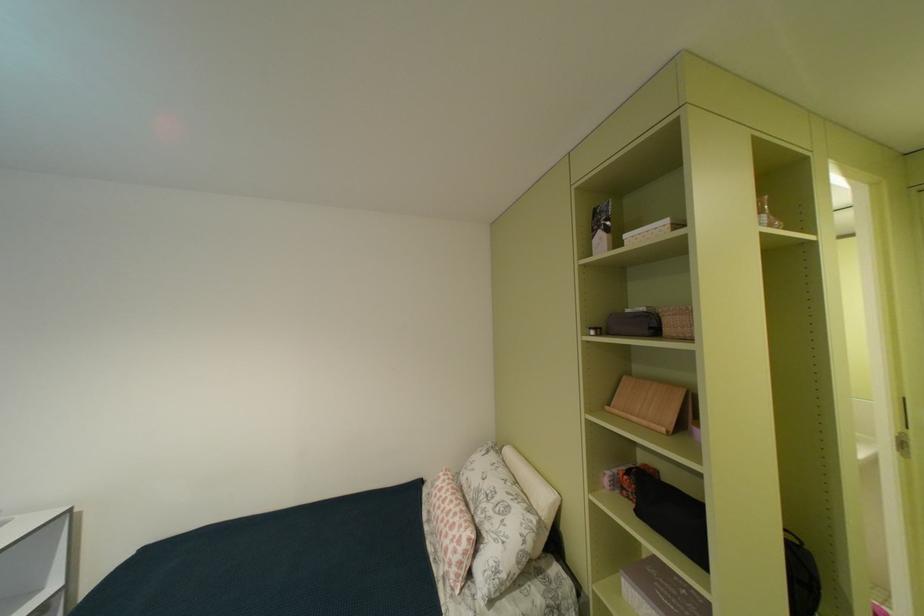
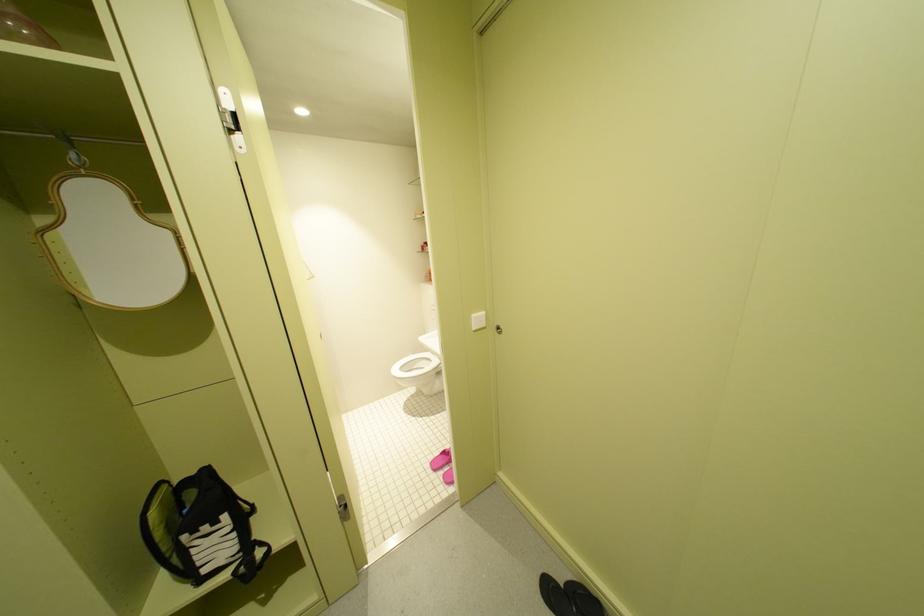
Question: In a continuous first-person perspective shot, in which direction is the camera moving?

Choices:
 (A) Left
 (B) Right
 (C) Forward
 (D) Backward

Answer: (B)